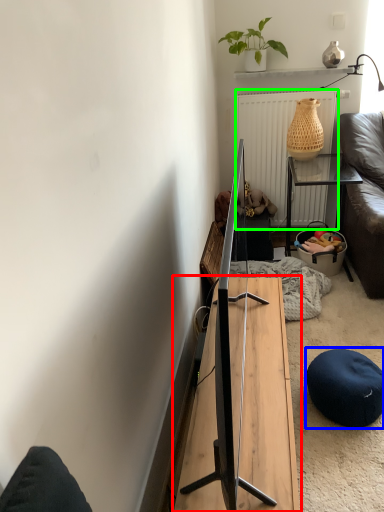
Question: Considering the real-world distances, which object is farthest from table (highlighted by a red box)? stool (highlighted by a blue box) or radiator (highlighted by a green box)?

Choices:
 (A) stool
 (B) radiator

Answer: (B)